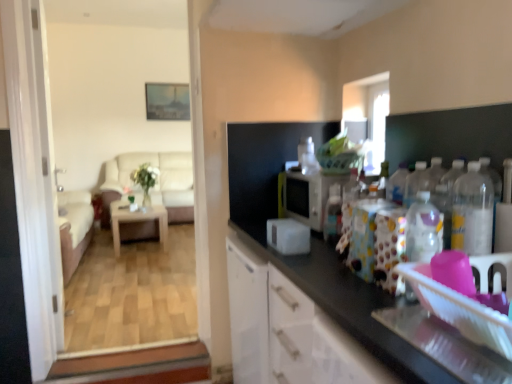
Question: Is beige fabric couch at left with green glass vase at center?

Choices:
 (A) yes
 (B) no

Answer: (B)

Question: From the image's perspective, is beige fabric couch at left below green glass vase at center?

Choices:
 (A) yes
 (B) no

Answer: (B)

Question: Would you say green glass vase at center is part of beige fabric couch at left's contents?

Choices:
 (A) yes
 (B) no

Answer: (B)

Question: Considering the relative sizes of beige fabric couch at left and green glass vase at center in the image provided, is beige fabric couch at left wider than green glass vase at center?

Choices:
 (A) yes
 (B) no

Answer: (A)

Question: Considering the relative sizes of beige fabric couch at left and green glass vase at center in the image provided, is beige fabric couch at left smaller than green glass vase at center?

Choices:
 (A) no
 (B) yes

Answer: (A)

Question: Does beige fabric couch at left appear on the left side of green glass vase at center?

Choices:
 (A) no
 (B) yes

Answer: (B)

Question: Is translucent plastic bottle at center, the 1th bottle from the left, to the right of clear plastic bottle at right, placed as the third bottle when sorted from left to right, from the viewer's perspective?

Choices:
 (A) yes
 (B) no

Answer: (B)

Question: Is translucent plastic bottle at center, the 1th bottle from the left, taller than clear plastic bottle at right, positioned as the 2th bottle in back-to-front order?

Choices:
 (A) yes
 (B) no

Answer: (B)

Question: Is translucent plastic bottle at center, the 1th bottle positioned from the back, wider than clear plastic bottle at right, positioned as the first bottle in right-to-left order?

Choices:
 (A) yes
 (B) no

Answer: (B)

Question: Is translucent plastic bottle at center, which is counted as the 3th bottle, starting from the right, oriented towards clear plastic bottle at right, positioned as the first bottle in right-to-left order?

Choices:
 (A) no
 (B) yes

Answer: (A)

Question: Would you say clear plastic bottle at right, placed as the third bottle when sorted from left to right, is part of translucent plastic bottle at center, the 1th bottle positioned from the back,'s contents?

Choices:
 (A) yes
 (B) no

Answer: (B)

Question: Is translucent plastic bottle at center, the 3th bottle when ordered from front to back, turned away from clear plastic bottle at right, positioned as the first bottle in right-to-left order?

Choices:
 (A) no
 (B) yes

Answer: (A)

Question: Can you confirm if clear plastic bottle at right, positioned as the 2th bottle in back-to-front order, is wider than white matte microwave at center, placed as the 2th appliance when sorted from front to back?

Choices:
 (A) yes
 (B) no

Answer: (B)